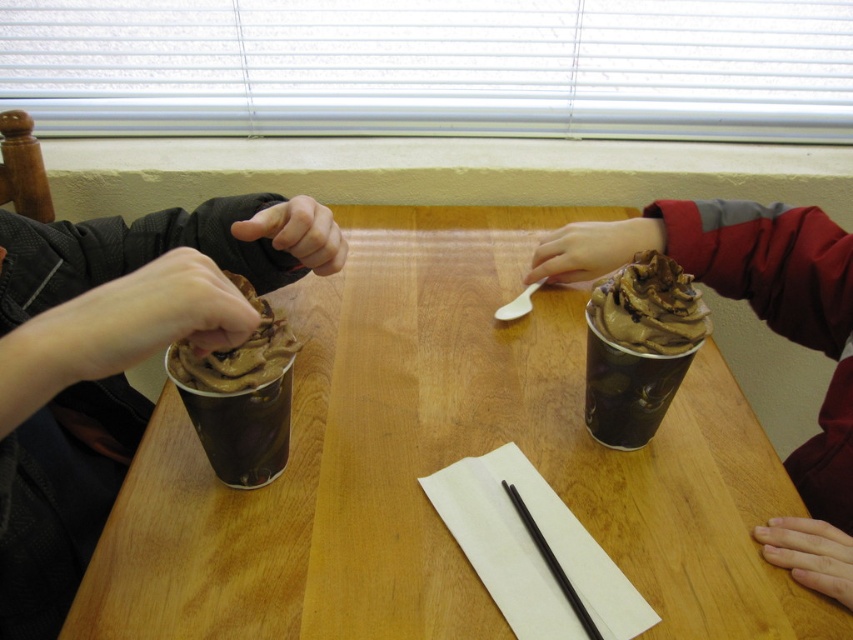
Question: Can you confirm if matte chocolate ice cream at left is wider than chocolate frosted cupcake at left?

Choices:
 (A) yes
 (B) no

Answer: (A)

Question: Which point is farther to the camera?

Choices:
 (A) chocolate soft serve ice cream at right
 (B) chocolate matte cup at center

Answer: (B)

Question: Considering the real-world distances, which object is closest to the chocolate frosted cupcake at left?

Choices:
 (A) chocolate matte cup at center
 (B) wooden table at center
 (C) smooth chocolate ice cream at right
 (D) chocolate soft serve ice cream at right

Answer: (B)

Question: Based on their relative distances, which object is farther from the chocolate frosted cup at left?

Choices:
 (A) chocolate frosted cupcake at left
 (B) chocolate soft serve ice cream at right
 (C) matte chocolate ice cream at left

Answer: (B)

Question: Is smooth chocolate ice cream at right to the right of chocolate frosted cupcake at left from the viewer's perspective?

Choices:
 (A) no
 (B) yes

Answer: (B)

Question: Is wooden table at center smaller than matte chocolate ice cream at left?

Choices:
 (A) no
 (B) yes

Answer: (A)